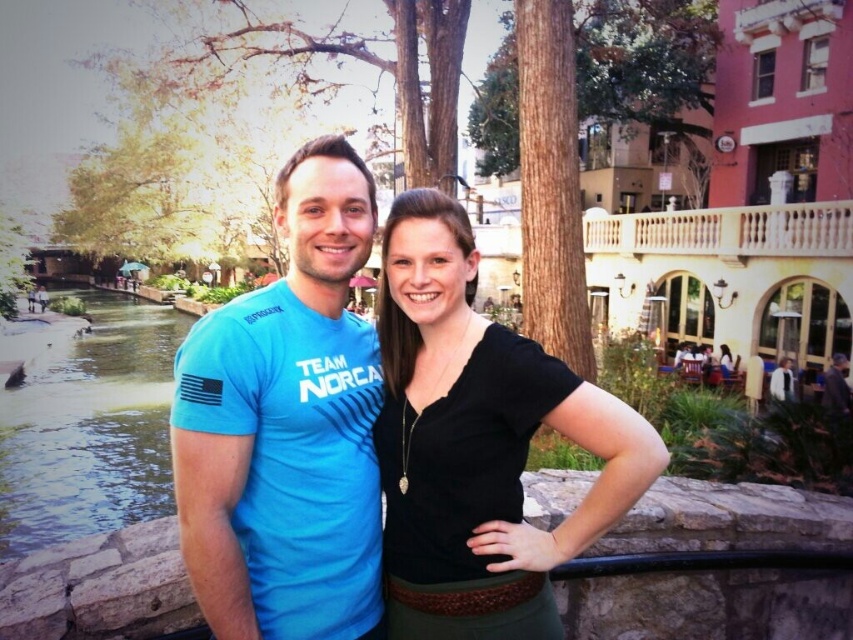
Which is in front, point (215, 582) or point (831, 380)?

Point (215, 582) is more forward.

Can you confirm if blue fabric shirt at center is bigger than dark gray fabric jacket at center?

Yes, blue fabric shirt at center is bigger than dark gray fabric jacket at center.

Does point (300, 154) come farther from viewer compared to point (824, 397)?

No, (300, 154) is in front of (824, 397).

Find the location of a particular element. Image resolution: width=853 pixels, height=640 pixels. blue fabric shirt at center is located at coordinates (286, 426).

The image size is (853, 640). Identify the location of blue fabric shirt at center. (286, 426).

Does point (370, 563) come farther from viewer compared to point (398, 513)?

No, it is in front of (398, 513).

Locate an element on the screen. This screenshot has height=640, width=853. blue fabric shirt at center is located at coordinates (286, 426).

Which is behind, point (399, 237) or point (836, 397)?

The point (836, 397) is behind.

Who is more forward, (x=463, y=292) or (x=825, y=371)?

Point (x=463, y=292) is in front.

Find the location of a particular element. The height and width of the screenshot is (640, 853). black matte shirt at center is located at coordinates (479, 444).